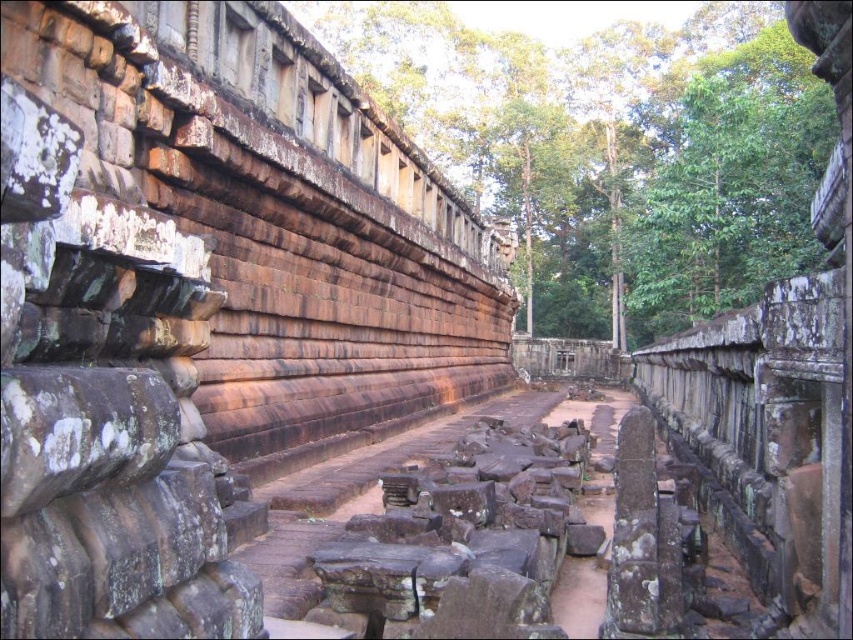
Question: Is weathered stone railing at upper center smaller than rusty stone steps at center?

Choices:
 (A) no
 (B) yes

Answer: (A)

Question: Among these points, which one is farthest from the camera?

Choices:
 (A) (695, 452)
 (B) (538, 440)

Answer: (B)

Question: Which point is closer to the camera taking this photo?

Choices:
 (A) (415, 506)
 (B) (693, 422)

Answer: (A)

Question: Is weathered stone railing at upper center positioned in front of rusty stone steps at center?

Choices:
 (A) yes
 (B) no

Answer: (A)

Question: Can you confirm if weathered stone railing at upper center is positioned to the right of rusty stone steps at center?

Choices:
 (A) no
 (B) yes

Answer: (B)

Question: Which point is farther from the camera taking this photo?

Choices:
 (A) (396, 580)
 (B) (821, 508)

Answer: (A)